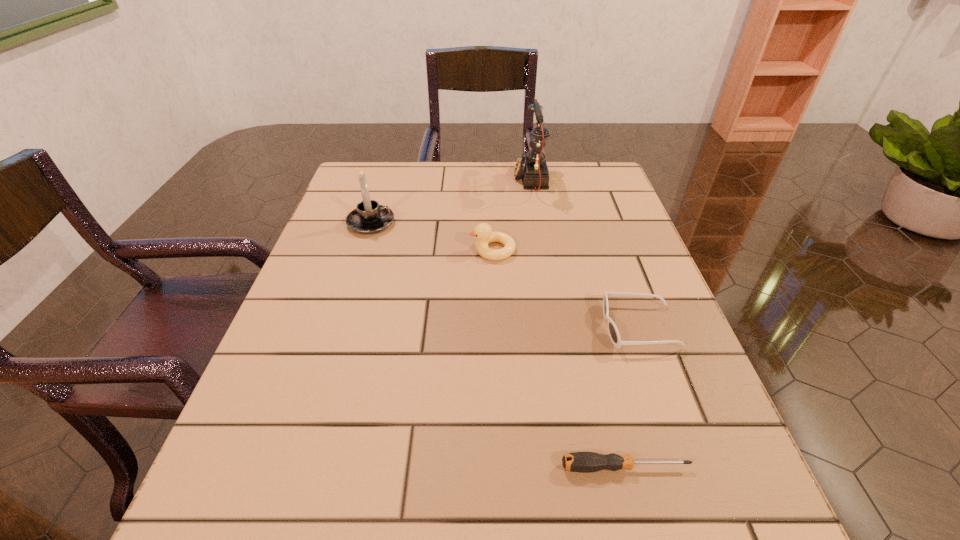
Where is `unoccupied position between the second farthest object and the duckling`? unoccupied position between the second farthest object and the duckling is located at coordinates (432, 237).

Where is `free space that is in between the farthest object and the leftmost object`? This screenshot has width=960, height=540. free space that is in between the farthest object and the leftmost object is located at coordinates (451, 201).

Locate an element on the screen. This screenshot has width=960, height=540. object that stands as the second closest to the duckling is located at coordinates (369, 217).

Where is `object that is the second closest to the fourth farthest object`? object that is the second closest to the fourth farthest object is located at coordinates (483, 232).

What are the coordinates of `vacant region that satisfies the following two spatial constraints: 1. with a handle on the side of the shortest object; 2. on the right side of the fourth nearest object` in the screenshot? It's located at (294, 467).

The image size is (960, 540). I want to click on free space that satisfies the following two spatial constraints: 1. on the back side of the nearest object; 2. with a handle on the side of the leftmost object, so click(x=564, y=223).

The image size is (960, 540). Identify the location of vacant space that satisfies the following two spatial constraints: 1. at the beak of the screwdriver; 2. on the left side of the fourth object from right to left. (500, 467).

Image resolution: width=960 pixels, height=540 pixels. What are the coordinates of `free location that satisfies the following two spatial constraints: 1. on the dial of the nearest object; 2. on the right side of the farthest object` in the screenshot? It's located at (579, 467).